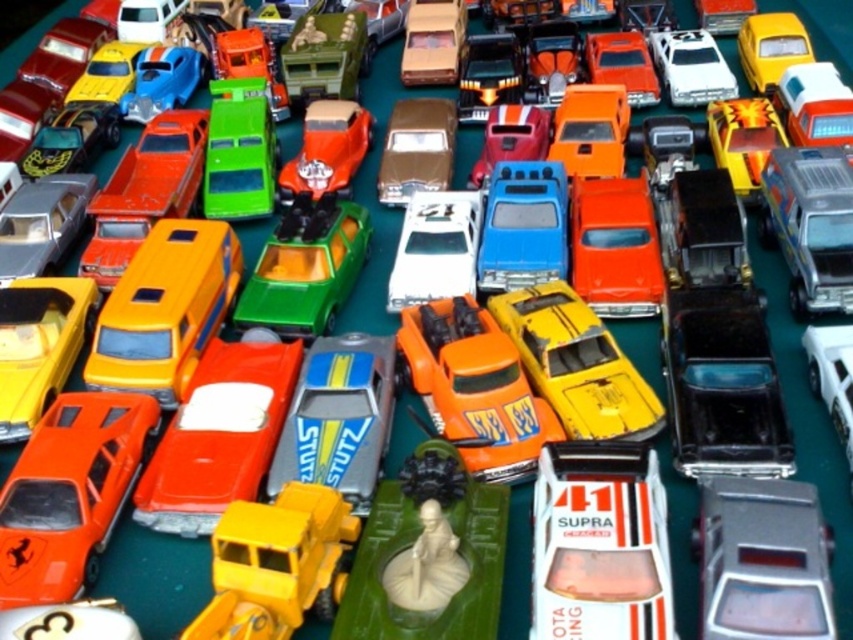
Question: Which of these objects is positioned farthest from the orange matte truck at center?

Choices:
 (A) matte yellow car at left
 (B) matte orange truck at center
 (C) yellow matte car at center

Answer: (A)

Question: Can you confirm if matte green figure at center is bigger than metallic silver truck at right?

Choices:
 (A) yes
 (B) no

Answer: (A)

Question: Which of the following is the closest to the observer?

Choices:
 (A) shiny orange car at center
 (B) matte yellow car at left
 (C) white glossy supra at center
 (D) orange matte supra at lower left

Answer: (C)

Question: Is orange matte supra at lower left thinner than metallic silver truck at right?

Choices:
 (A) yes
 (B) no

Answer: (B)

Question: Estimate the real-world distances between objects in this image. Which object is farther from the orange matte supra at lower left?

Choices:
 (A) shiny metallic car at upper right
 (B) green plastic truck at upper center

Answer: (A)

Question: Is green plastic car at center positioned before yellow matte car at upper right?

Choices:
 (A) yes
 (B) no

Answer: (A)